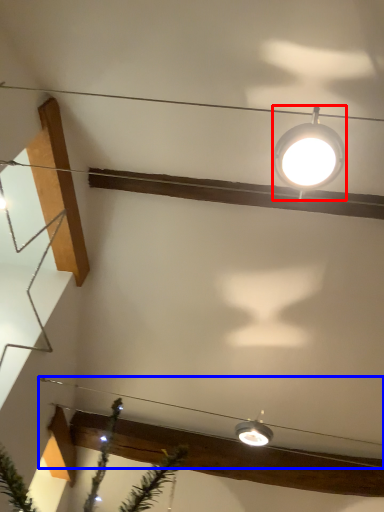
Question: Which object is closer to the camera taking this photo, lamp (highlighted by a red box) or wire (highlighted by a blue box)?

Choices:
 (A) lamp
 (B) wire

Answer: (A)